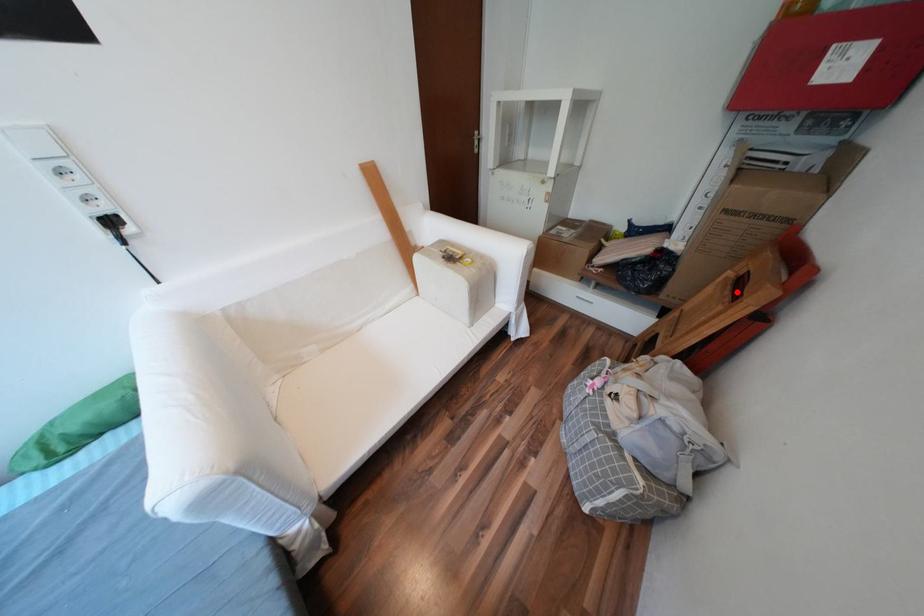
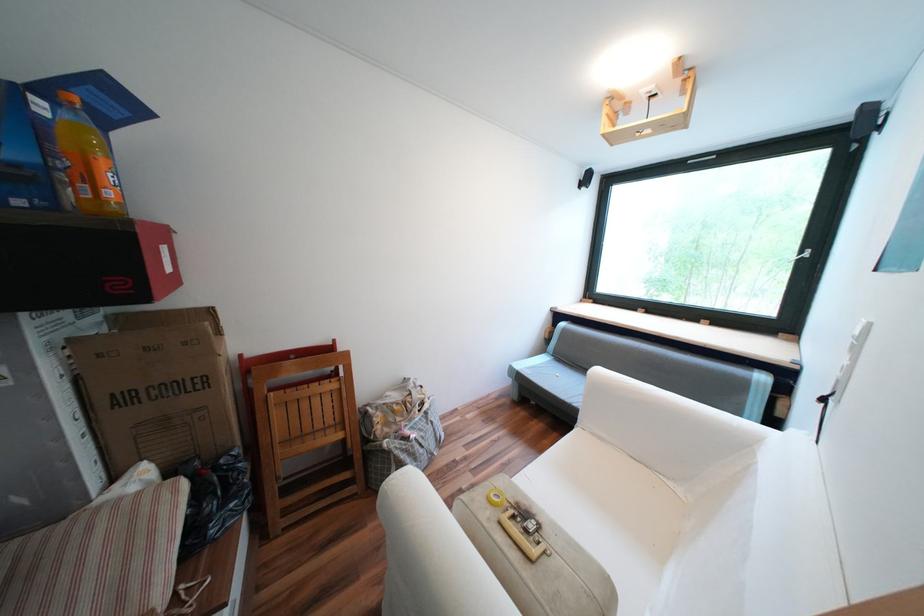
The point at the highlighted location is marked in the first image. Where is the corresponding point in the second image?

(325, 383)